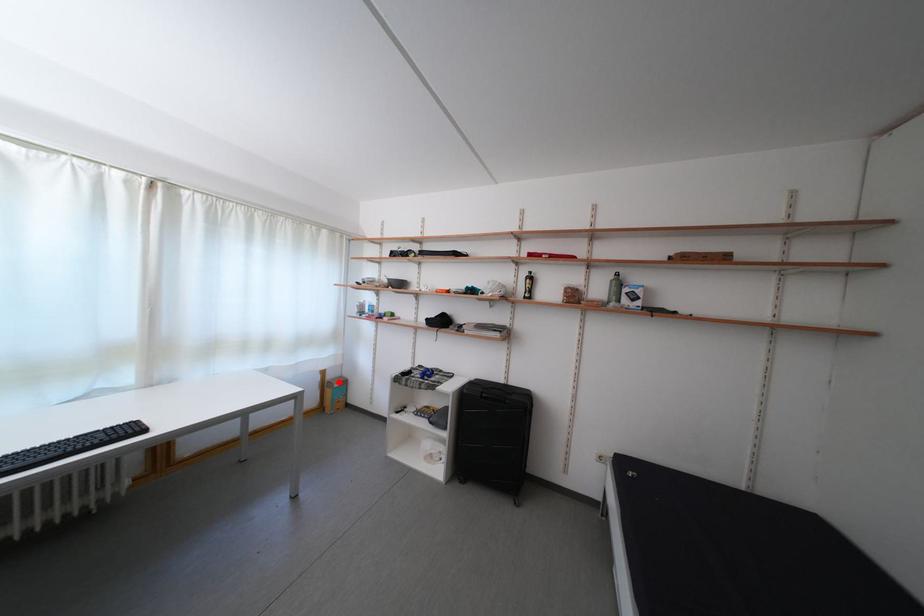
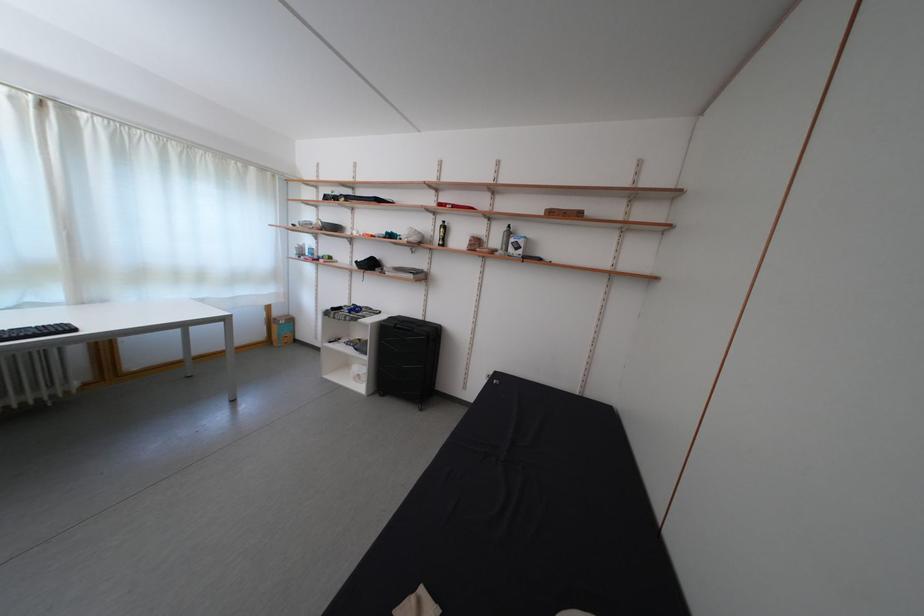
Question: I am providing you with two images of the same scene from different viewpoints. A red point is marked on the first image. Can you still see the location of the red point in image 2?

Choices:
 (A) Yes
 (B) No

Answer: (A)